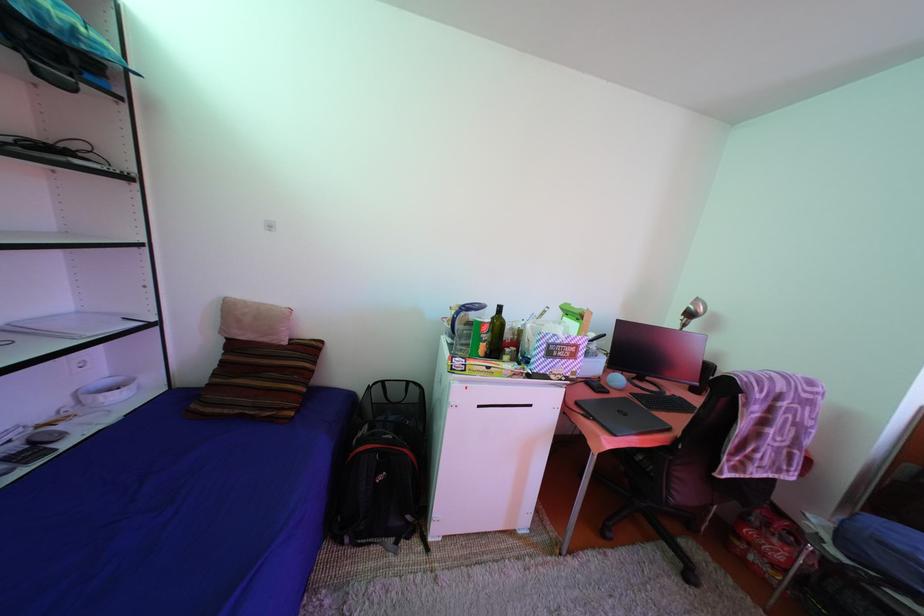
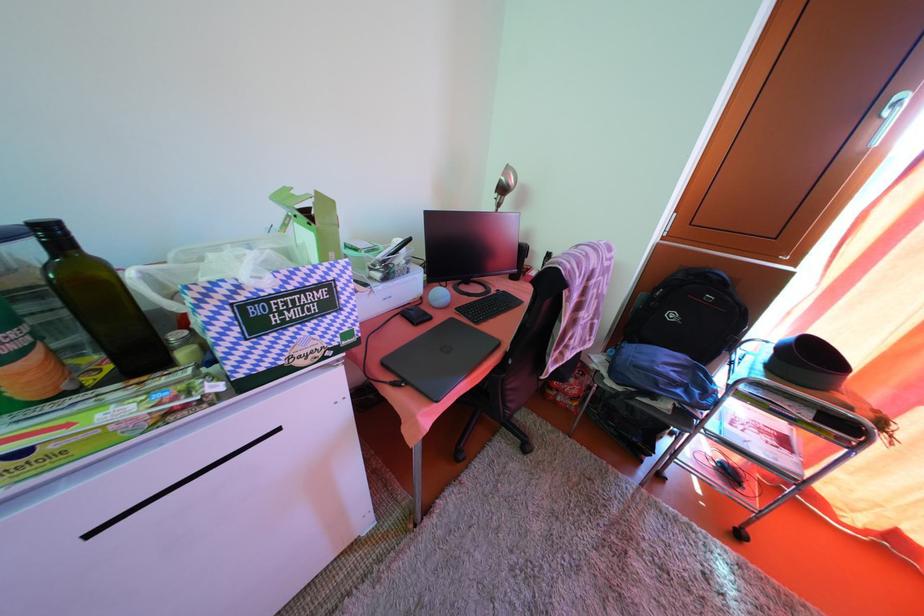
Based on the continuous images, in which direction is the camera rotating?

The camera's rotation is toward right-down.